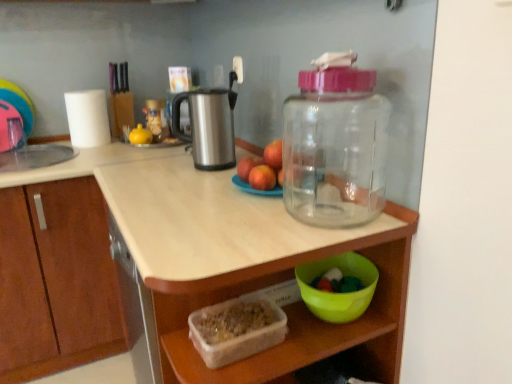
Where is `free region on the left part of yellow rubber duck at center`? free region on the left part of yellow rubber duck at center is located at coordinates coord(101,147).